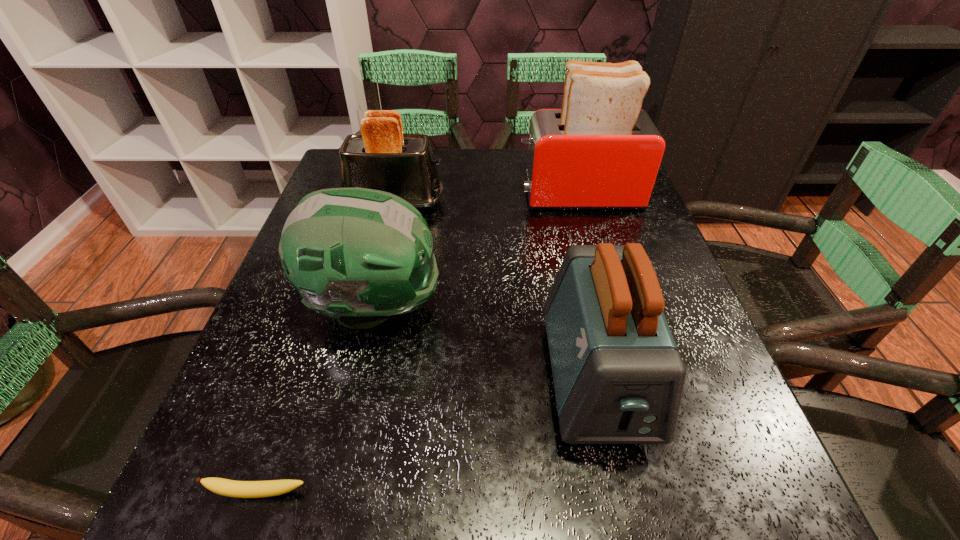
Find the location of a particular element. The width and height of the screenshot is (960, 540). the closest object relative to the nearest toaster is located at coordinates (357, 255).

This screenshot has width=960, height=540. In order to click on object that is the second closest to the leftmost toaster in this screenshot , I will do `click(601, 151)`.

Locate which toaster ranks in proximity to the football helmet. Please provide its 2D coordinates. Your answer should be formatted as a tuple, i.e. [(x, y)], where the tuple contains the x and y coordinates of a point satisfying the conditions above.

[(382, 157)]

Locate which toaster is the closest to the shortest object. Please provide its 2D coordinates. Your answer should be formatted as a tuple, i.e. [(x, y)], where the tuple contains the x and y coordinates of a point satisfying the conditions above.

[(618, 377)]

Locate an element on the screen. free space that satisfies the following two spatial constraints: 1. on the front-facing side of the tallest object; 2. on the front-facing side of the nearest toaster is located at coordinates (631, 379).

Locate an element on the screen. This screenshot has width=960, height=540. vacant area in the image that satisfies the following two spatial constraints: 1. on the front-facing side of the tallest object; 2. on the upward curve of the nearest object is located at coordinates (663, 493).

Image resolution: width=960 pixels, height=540 pixels. I want to click on vacant space that satisfies the following two spatial constraints: 1. on the front-facing side of the tallest toaster; 2. on the front-facing side of the nearest toaster, so click(631, 379).

This screenshot has height=540, width=960. I want to click on vacant area in the image that satisfies the following two spatial constraints: 1. on the front-facing side of the tallest object; 2. on the upward curve of the shortest object, so click(663, 493).